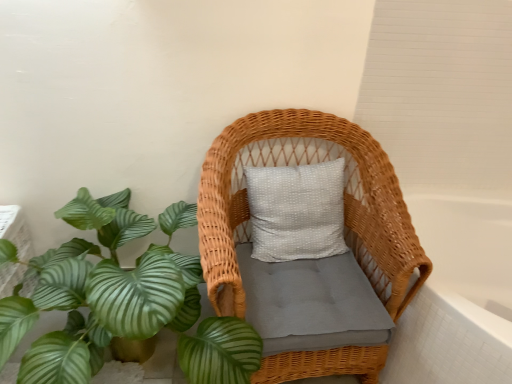
Question: In terms of height, does white glossy bathtub at right look taller or shorter compared to green leafy plant at lower left?

Choices:
 (A) short
 (B) tall

Answer: (A)

Question: Is white glossy bathtub at right in front of or behind green leafy plant at lower left in the image?

Choices:
 (A) front
 (B) behind

Answer: (B)

Question: Which object is the closest to the green leafy plant at lower left?

Choices:
 (A) white glossy bathtub at right
 (B) woven wicker chair at center

Answer: (B)

Question: Which object is the closest to the green leafy plant at lower left?

Choices:
 (A) white glossy bathtub at right
 (B) woven wicker chair at center

Answer: (B)